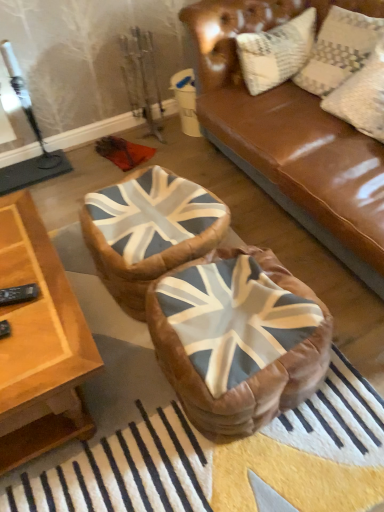
Question: From a real-world perspective, is textured cream pillow at upper right over wooden table at lower left?

Choices:
 (A) yes
 (B) no

Answer: (A)

Question: Considering the relative sizes of textured cream pillow at upper right and wooden table at lower left in the image provided, is textured cream pillow at upper right wider than wooden table at lower left?

Choices:
 (A) no
 (B) yes

Answer: (A)

Question: Is the depth of textured cream pillow at upper right less than that of wooden table at lower left?

Choices:
 (A) yes
 (B) no

Answer: (B)

Question: Does textured cream pillow at upper right have a smaller size compared to wooden table at lower left?

Choices:
 (A) no
 (B) yes

Answer: (B)

Question: Is the depth of textured cream pillow at upper right greater than that of wooden table at lower left?

Choices:
 (A) no
 (B) yes

Answer: (B)

Question: From the image's perspective, is wooden table at lower left positioned above or below leather bean bag at center, acting as the first bean bag chair starting from the front?

Choices:
 (A) above
 (B) below

Answer: (A)

Question: Considering their positions, is wooden table at lower left located in front of or behind leather bean bag at center, acting as the first bean bag chair starting from the front?

Choices:
 (A) behind
 (B) front

Answer: (B)

Question: Based on their sizes in the image, would you say wooden table at lower left is bigger or smaller than leather bean bag at center, acting as the first bean bag chair starting from the front?

Choices:
 (A) big
 (B) small

Answer: (A)

Question: Considering the positions of wooden table at lower left and leather bean bag at center, positioned as the 2th bean bag chair in back-to-front order, in the image, is wooden table at lower left wider or thinner than leather bean bag at center, positioned as the 2th bean bag chair in back-to-front order,?

Choices:
 (A) wide
 (B) thin

Answer: (A)

Question: In the image, is leather bean bag at center, acting as the first bean bag chair starting from the front, positioned in front of or behind textured cream pillow at upper right?

Choices:
 (A) front
 (B) behind

Answer: (A)

Question: Based on their sizes in the image, would you say leather bean bag at center, acting as the first bean bag chair starting from the front, is bigger or smaller than textured cream pillow at upper right?

Choices:
 (A) big
 (B) small

Answer: (A)

Question: From the image's perspective, is leather bean bag at center, acting as the first bean bag chair starting from the front, located above or below textured cream pillow at upper right?

Choices:
 (A) below
 (B) above

Answer: (A)

Question: Would you say leather bean bag at center, positioned as the 2th bean bag chair in back-to-front order, is to the left or to the right of textured cream pillow at upper right in the picture?

Choices:
 (A) right
 (B) left

Answer: (B)

Question: From a real-world perspective, is leather union jack bean bag at center, the 1th bean bag chair viewed from the back, physically located above or below leather bean bag at center, acting as the first bean bag chair starting from the front?

Choices:
 (A) above
 (B) below

Answer: (B)

Question: Is point (215, 205) positioned closer to the camera than point (264, 294)?

Choices:
 (A) closer
 (B) farther

Answer: (B)